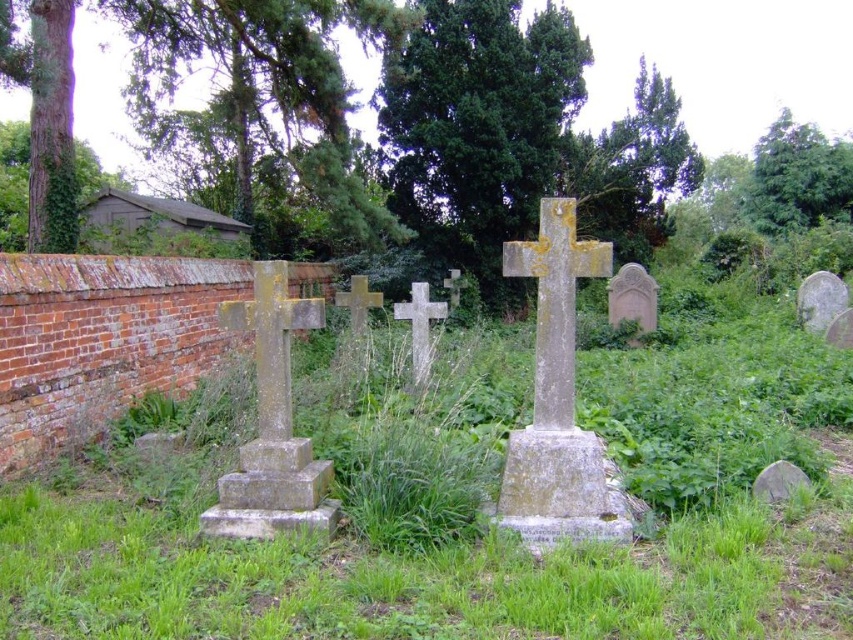
Question: Which point appears farthest from the camera in this image?

Choices:
 (A) (548, 316)
 (B) (402, 317)
 (C) (380, 292)

Answer: (C)

Question: Among these points, which one is nearest to the camera?

Choices:
 (A) (554, 429)
 (B) (340, 292)
 (C) (416, 358)
 (D) (689, 454)

Answer: (A)

Question: Is green grass at center positioned in front of stone cross at center?

Choices:
 (A) yes
 (B) no

Answer: (A)

Question: Can you confirm if yellowish stone cross at center is positioned to the right of gold metallic cross at center?

Choices:
 (A) no
 (B) yes

Answer: (B)

Question: Based on their relative distances, which object is farther from the yellowish stone cross at center?

Choices:
 (A) stone cross at center
 (B) green grass at center

Answer: (A)

Question: Is yellowish stone cross at center positioned in front of gold metallic cross at center?

Choices:
 (A) no
 (B) yes

Answer: (B)